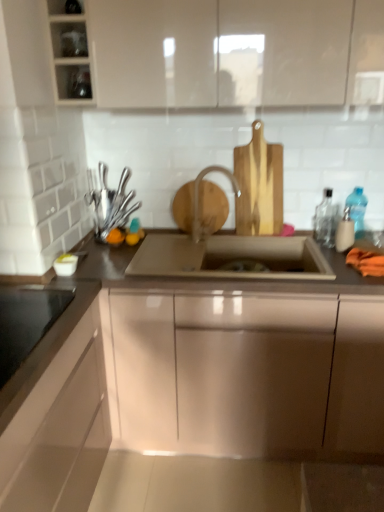
Identify the location of free space below transparent glass jars at upper left, positioned as the second shelf in top-to-bottom order (from a real-world perspective). (94, 240).